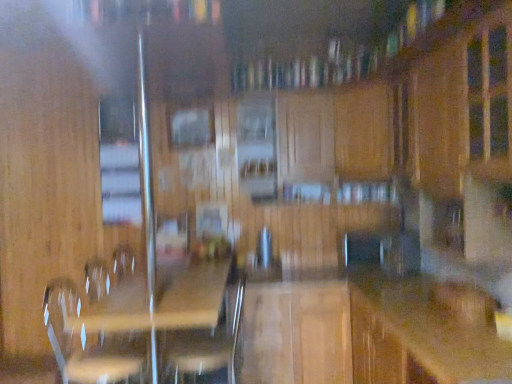
Question: From a real-world perspective, relative to wooden swivel chair at center, the 1th swivel chair when ordered from right to left, is clear wood picnic table at center vertically above or below?

Choices:
 (A) above
 (B) below

Answer: (B)

Question: Is clear wood picnic table at center wider or thinner than wooden swivel chair at center, arranged as the second swivel chair when viewed from the left?

Choices:
 (A) wide
 (B) thin

Answer: (A)

Question: Which object is positioned farthest from the wooden swivel chair at center, arranged as the second swivel chair when viewed from the left?

Choices:
 (A) clear plastic swivel chair at lower left, placed as the first swivel chair when sorted from left to right
 (B) wooden counter top at center
 (C) clear wood picnic table at center

Answer: (B)

Question: Based on their relative distances, which object is nearer to the clear plastic swivel chair at lower left, the 2th swivel chair viewed from the right?

Choices:
 (A) wooden swivel chair at center, the 1th swivel chair when ordered from right to left
 (B) clear wood picnic table at center
 (C) wooden counter top at center

Answer: (B)